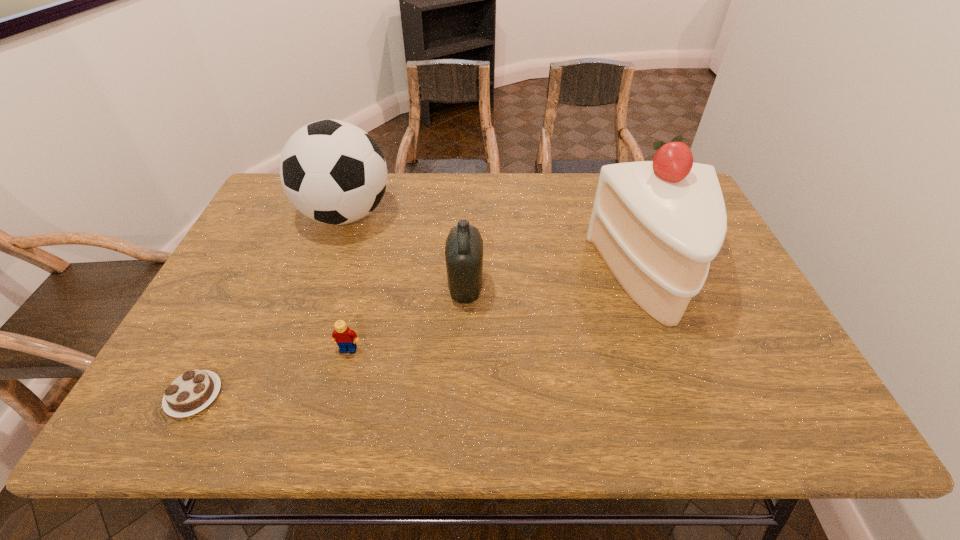
Locate an element on the screen. This screenshot has width=960, height=540. free space between the fourth farthest object and the bottle is located at coordinates (407, 319).

You are a GUI agent. You are given a task and a screenshot of the screen. Output one action in this format:
    pyautogui.click(x=<x>, y=<y>)
    Task: Click on the free spot between the fourth tallest object and the third shortest object
    This screenshot has height=540, width=960.
    Given the screenshot: What is the action you would take?
    pyautogui.click(x=407, y=319)

Find the location of a particular element. The height and width of the screenshot is (540, 960). empty space that is in between the nearest object and the second nearest object is located at coordinates (272, 373).

Find the location of a particular element. free space between the second tallest object and the bottle is located at coordinates (406, 252).

Locate which object is the second closest to the shortest object. Please provide its 2D coordinates. Your answer should be formatted as a tuple, i.e. [(x, y)], where the tuple contains the x and y coordinates of a point satisfying the conditions above.

[(332, 171)]

In order to click on the second closest object to the fourth farthest object in this screenshot , I will do (x=191, y=392).

Where is `vacant region that satisfies the following two spatial constraints: 1. on the back side of the nearest object; 2. on the left side of the bottle`? The height and width of the screenshot is (540, 960). vacant region that satisfies the following two spatial constraints: 1. on the back side of the nearest object; 2. on the left side of the bottle is located at coordinates (x=249, y=288).